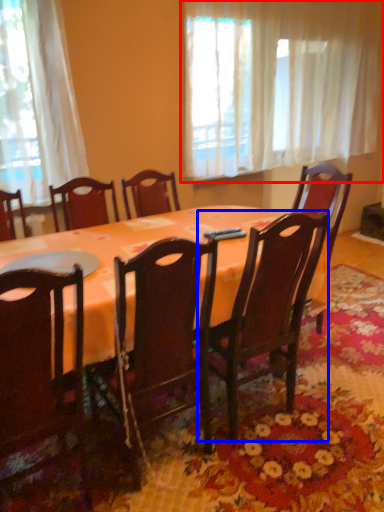
Question: Which point is further to the camera, curtain (highlighted by a red box) or chair (highlighted by a blue box)?

Choices:
 (A) curtain
 (B) chair

Answer: (A)